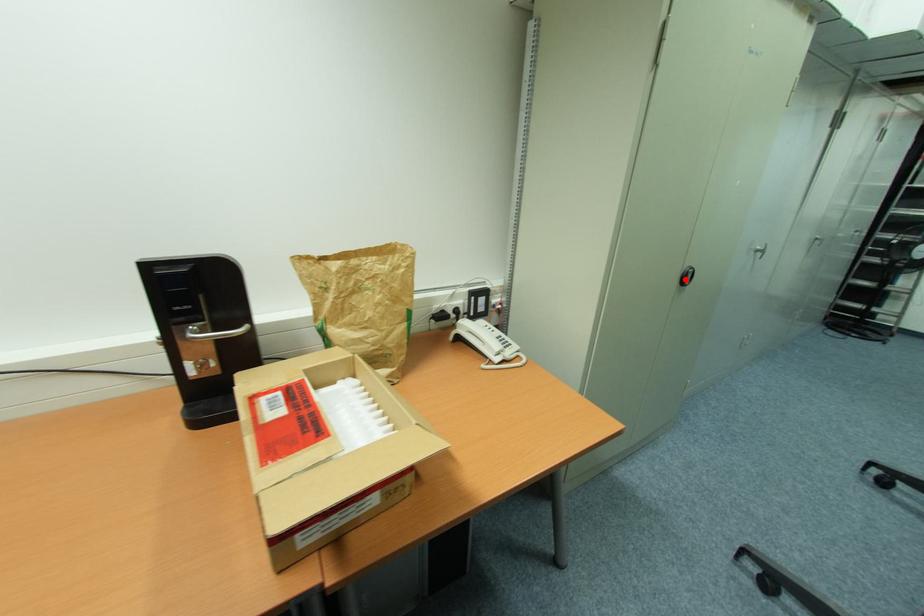
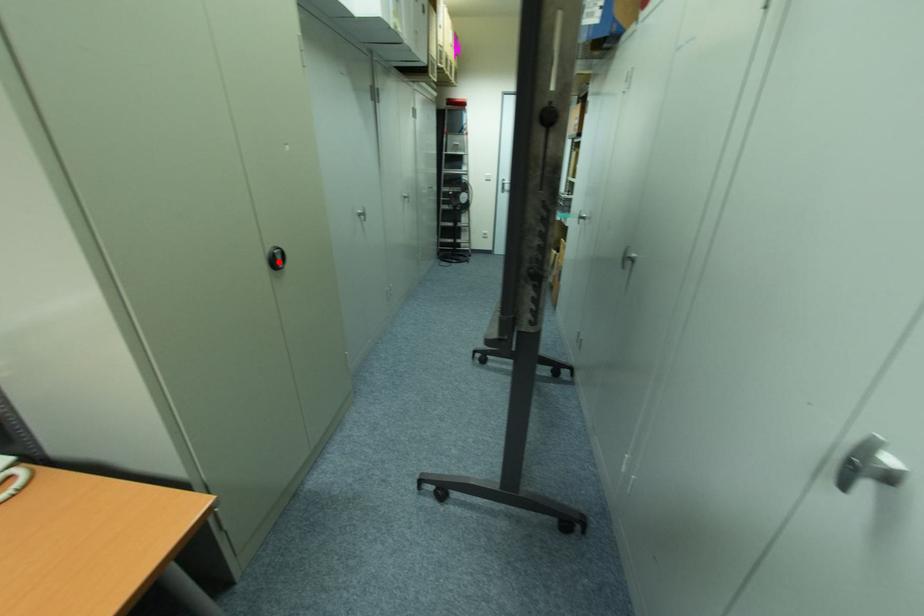
I am providing you with two images of the same scene from different viewpoints. A red point is marked on the first image and another point is marked on the second image. Do the highlighted points in image1 and image2 indicate the same real-world spot?

Yes